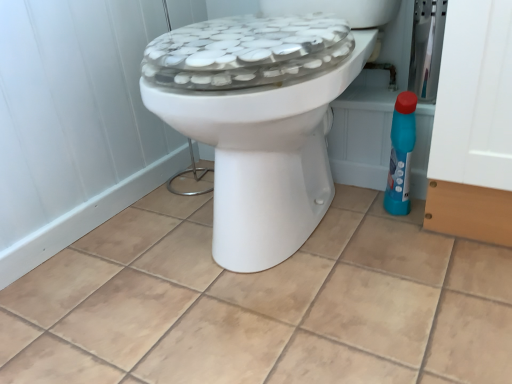
Question: From a real-world perspective, is blue plastic bottle at right physically located above or below white glossy toilet at center?

Choices:
 (A) above
 (B) below

Answer: (B)

Question: Considering the relative positions of blue plastic bottle at right and white glossy toilet at center in the image provided, is blue plastic bottle at right to the left or to the right of white glossy toilet at center?

Choices:
 (A) right
 (B) left

Answer: (A)

Question: Which object is the closest to the blue plastic bottle at right?

Choices:
 (A) white glossy toilet at center
 (B) beige ceramic tile at center

Answer: (A)

Question: Which object is positioned closest to the beige ceramic tile at center?

Choices:
 (A) blue plastic bottle at right
 (B) white glossy toilet at center

Answer: (B)